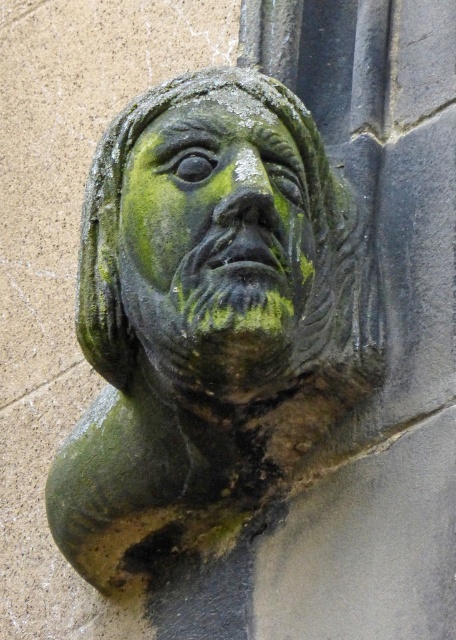
Which is behind, point (326, 323) or point (207, 296)?

The point (326, 323) is behind.

Is green stone bust at center below green stone face at center?

Correct, green stone bust at center is located below green stone face at center.

The height and width of the screenshot is (640, 456). What do you see at coordinates (208, 321) in the screenshot?
I see `green stone bust at center` at bounding box center [208, 321].

In order to click on green stone bust at center in this screenshot , I will do `click(208, 321)`.